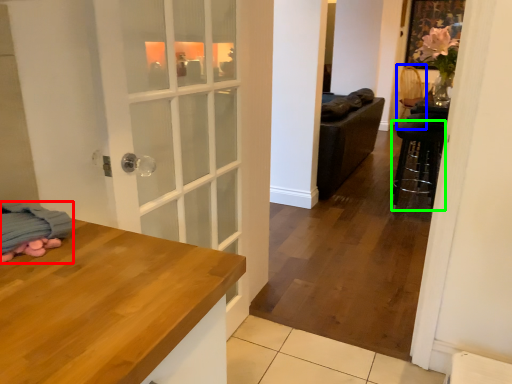
Question: Which object is the closest to the blanket (highlighted by a red box)? Choose among these: armchair (highlighted by a blue box) or bar stool (highlighted by a green box).

Choices:
 (A) armchair
 (B) bar stool

Answer: (B)